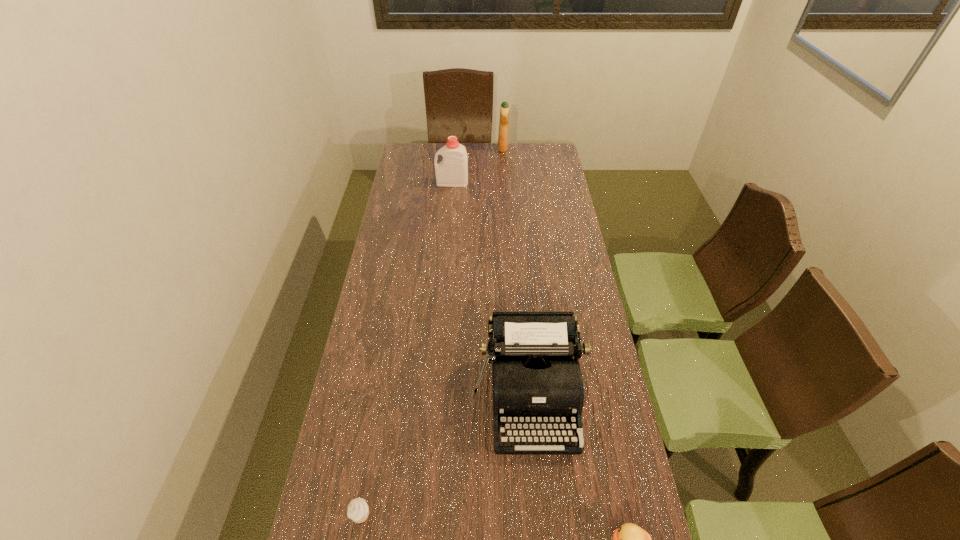
In order to click on blank region between the typewriter and the nearer detergent in this screenshot , I will do `click(491, 289)`.

Identify the location of free spot between the nearer detergent and the farther detergent. (478, 165).

Image resolution: width=960 pixels, height=540 pixels. I want to click on free space between the fourth object from right to left and the leftmost object, so click(x=408, y=350).

Identify the location of free space between the second object from left to right and the leftmost object. This screenshot has width=960, height=540. (408, 350).

This screenshot has height=540, width=960. I want to click on vacant area that lies between the leftmost object and the fourth nearest object, so tap(408, 350).

The width and height of the screenshot is (960, 540). I want to click on free area in between the farther detergent and the third tallest object, so click(516, 272).

Where is `free space that is in between the third shortest object and the icecream`? This screenshot has width=960, height=540. free space that is in between the third shortest object and the icecream is located at coordinates (446, 456).

The height and width of the screenshot is (540, 960). In order to click on free space between the fourth tallest object and the third shortest object in this screenshot , I will do `click(446, 456)`.

Locate which object is the third closest to the icecream. Please provide its 2D coordinates. Your answer should be formatted as a tuple, i.e. [(x, y)], where the tuple contains the x and y coordinates of a point satisfying the conditions above.

[(452, 171)]

Find the location of a particular element. Image resolution: width=960 pixels, height=540 pixels. the third closest object to the shortest object is located at coordinates (452, 171).